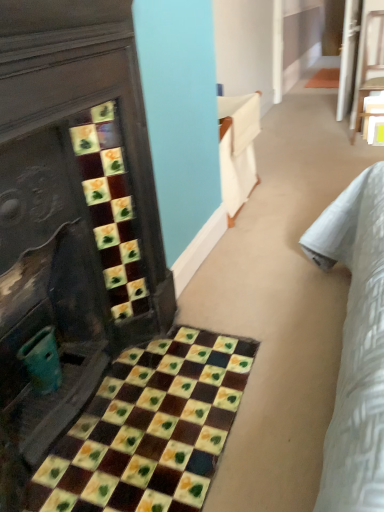
Question: Is wooden chair at upper right bigger or smaller than teal plastic cup at lower left?

Choices:
 (A) small
 (B) big

Answer: (B)

Question: Do you think wooden chair at upper right is within teal plastic cup at lower left, or outside of it?

Choices:
 (A) inside
 (B) outside

Answer: (B)

Question: Which object is the closest to the yellow matte square at center?

Choices:
 (A) wooden chair at upper right
 (B) teal plastic cup at lower left
 (C) multicolored mosaic tiles at lower left

Answer: (A)

Question: Which object is the farthest from the multicolored mosaic tiles at lower left?

Choices:
 (A) teal plastic cup at lower left
 (B) yellow matte square at center
 (C) wooden chair at upper right

Answer: (C)